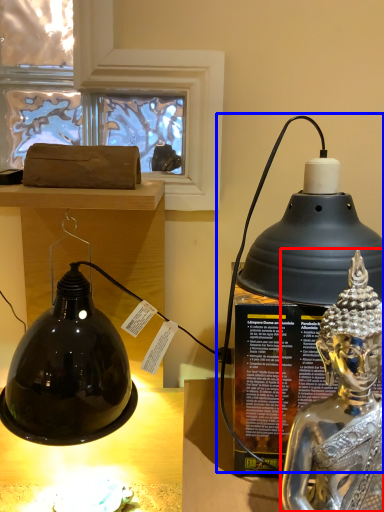
Question: Among these objects, which one is farthest to the camera, person (highlighted by a red box) or oil lamp (highlighted by a blue box)?

Choices:
 (A) person
 (B) oil lamp

Answer: (B)